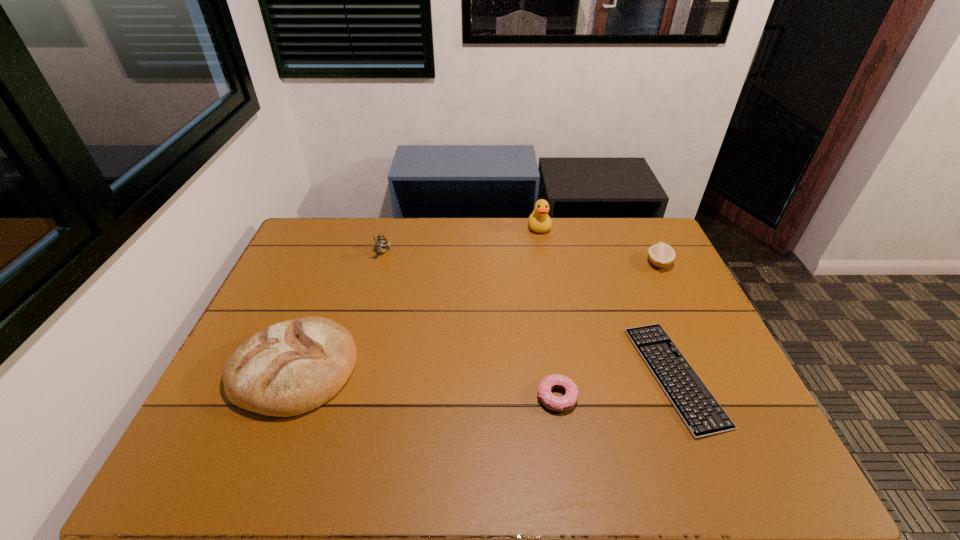
I want to click on empty space that is in between the fifth tallest object and the computer keyboard, so click(615, 387).

Identify the location of free spot between the computer keyboard and the doughnut. The width and height of the screenshot is (960, 540). (x=615, y=387).

Where is `free space between the duck and the third shortest object`? The image size is (960, 540). free space between the duck and the third shortest object is located at coordinates (599, 245).

The image size is (960, 540). In order to click on blank region between the computer keyboard and the snail in this screenshot , I will do `click(528, 314)`.

This screenshot has width=960, height=540. I want to click on vacant area that lies between the fifth tallest object and the computer keyboard, so click(x=615, y=387).

Locate an element on the screen. The image size is (960, 540). free space that is in between the bread and the lemon is located at coordinates (476, 315).

Locate which object ranks second in proximity to the snail. Please provide its 2D coordinates. Your answer should be formatted as a tuple, i.e. [(x, y)], where the tuple contains the x and y coordinates of a point satisfying the conditions above.

[(539, 221)]

Identify the location of object that stands as the second closest to the farthest object. (700, 411).

Image resolution: width=960 pixels, height=540 pixels. Identify the location of vacant area in the image that satisfies the following two spatial constraints: 1. on the face of the shortest object; 2. on the left side of the snail. (349, 376).

This screenshot has height=540, width=960. Identify the location of free point that satisfies the following two spatial constraints: 1. on the face of the computer keyboard; 2. on the right side of the snail. (349, 376).